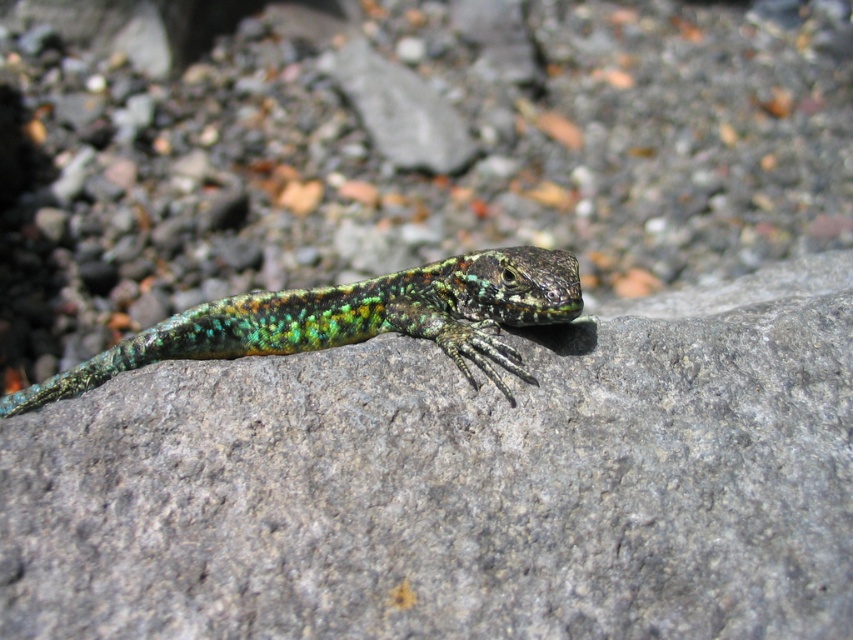
Question: Is green speckled rock at center positioned before shiny green lizard at center?

Choices:
 (A) yes
 (B) no

Answer: (A)

Question: Can you confirm if green speckled rock at center is smaller than shiny green lizard at center?

Choices:
 (A) no
 (B) yes

Answer: (A)

Question: Among these points, which one is nearest to the camera?

Choices:
 (A) (596, 355)
 (B) (368, 336)

Answer: (A)

Question: Which of the following is the farthest from the observer?

Choices:
 (A) (457, 355)
 (B) (833, 541)

Answer: (A)

Question: Is the position of green speckled rock at center less distant than that of shiny green lizard at center?

Choices:
 (A) yes
 (B) no

Answer: (A)

Question: Which point is farther to the camera?

Choices:
 (A) (28, 435)
 (B) (422, 312)

Answer: (B)